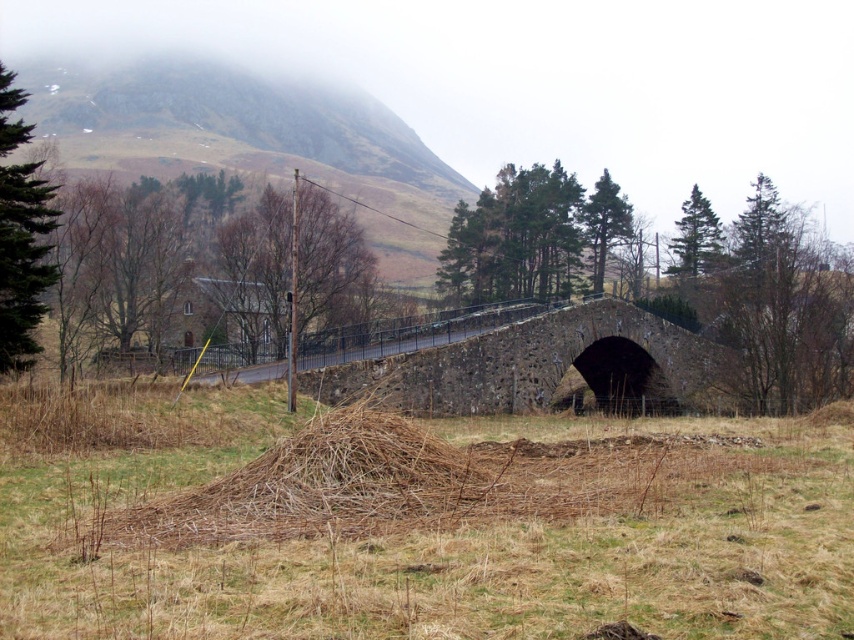
Is brown dry grass at lower center positioned before stone bridge at center?

Yes, brown dry grass at lower center is closer to the viewer.

Does brown dry grass at lower center have a greater width compared to stone bridge at center?

In fact, brown dry grass at lower center might be narrower than stone bridge at center.

Image resolution: width=854 pixels, height=640 pixels. I want to click on brown dry grass at lower center, so click(430, 529).